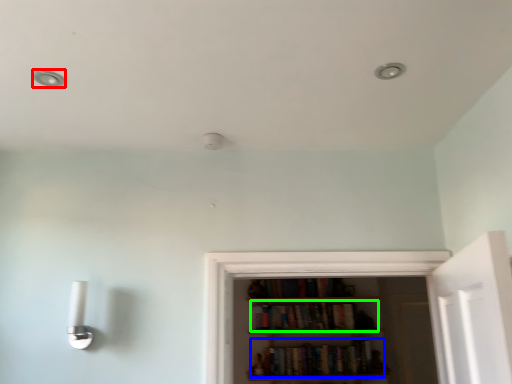
Question: Estimate the real-world distances between objects in this image. Which object is closer to dot (highlighted by a red box), book (highlighted by a blue box) or book (highlighted by a green box)?

Choices:
 (A) book
 (B) book

Answer: (B)